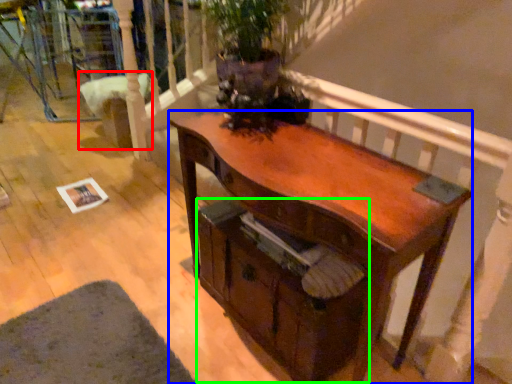
Question: Which object is positioned farthest from armchair (highlighted by a red box)? Select from desk (highlighted by a blue box) and drawer (highlighted by a green box).

Choices:
 (A) desk
 (B) drawer

Answer: (A)